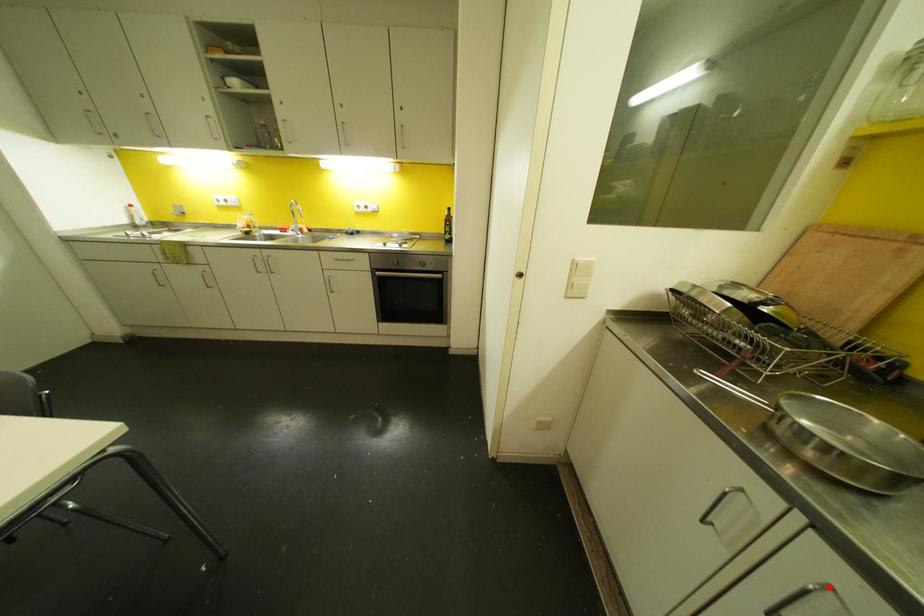
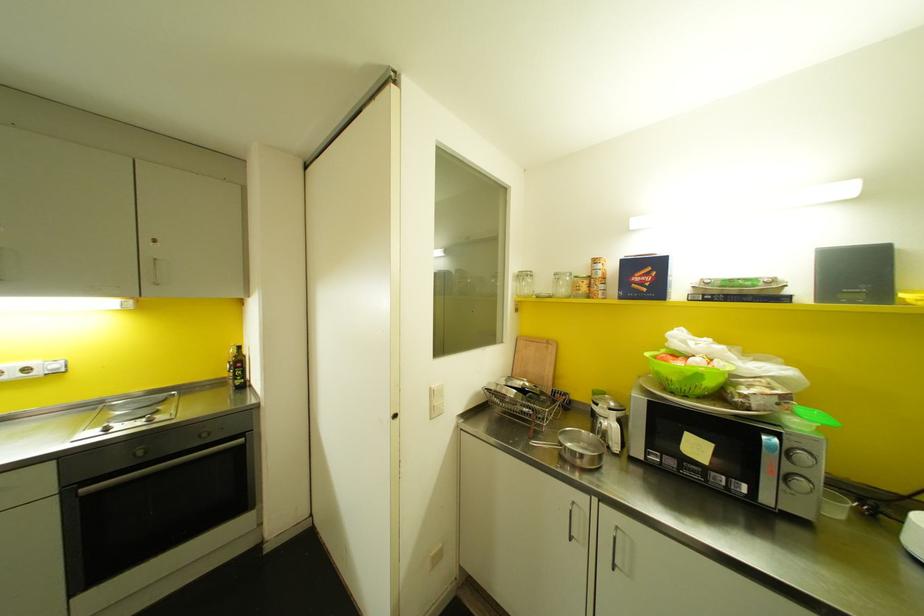
Locate, in the second image, the point that corresponds to the highlighted location in the first image.

(616, 527)